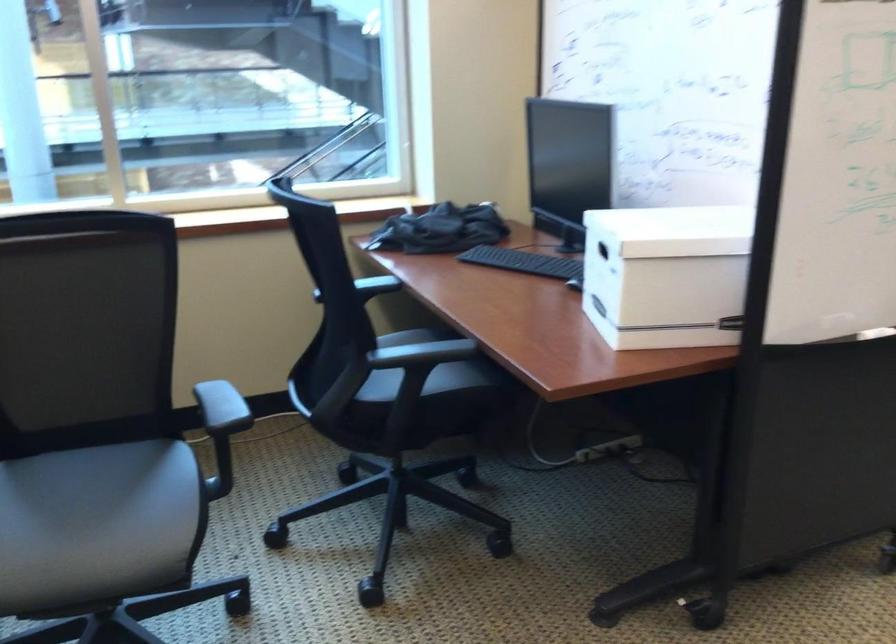
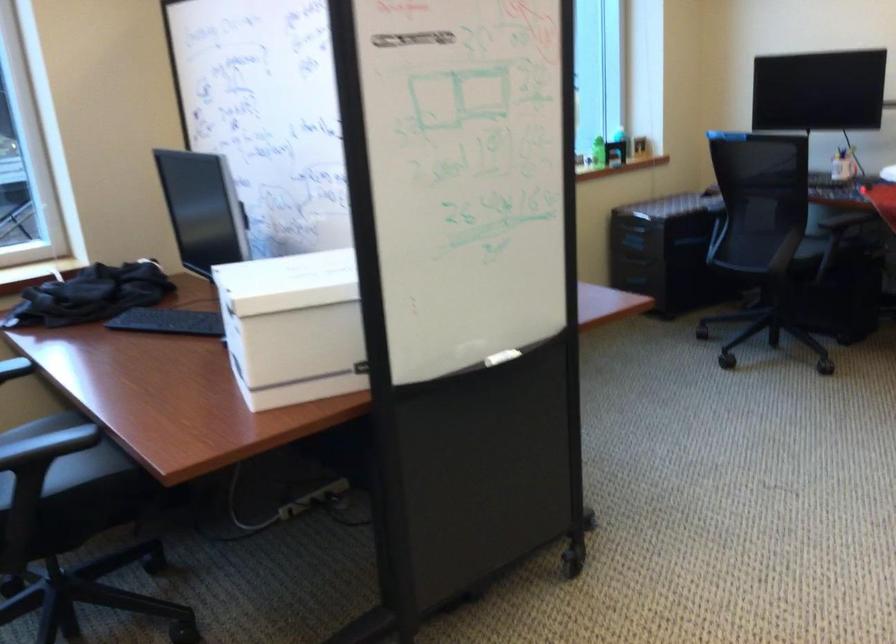
Where in the second image is the point corresponding to (x=665, y=276) from the first image?

(293, 327)